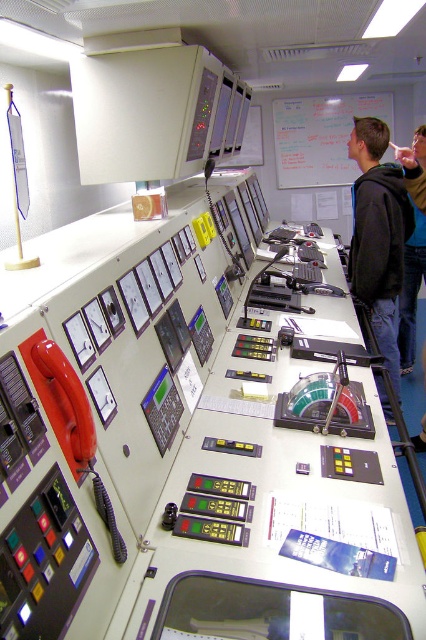
You are a crew member in the control room and need to quickly access both the dark gray hoodie at center and the blue denim jeans at lower right. Based on their positions, which item is closer to the emergency red telephone on the left wall?

The dark gray hoodie at center is located below the blue denim jeans at lower right. Since the blue denim jeans at lower right are higher up, they are closer to the emergency red telephone on the left wall than the dark gray hoodie at center.

You are a technician in the control room who needs to reach the blue denim jeans at lower right from the whiteboard at upper center. Given that your tool box is 3 feet wide, can you safely move through the space between them?

The distance between the whiteboard at upper center and blue denim jeans at lower right is 6.90 feet. Since your tool box is 3 feet wide, there is enough space to move safely between them.

You are a crew member in the control room and need to locate the whiteboard at upper center and the blue denim jeans at lower right. Which object is closer to the left side of the room?

The whiteboard at upper center is positioned on the left side of blue denim jeans at lower right, so the whiteboard at upper center is closer to the left side of the room.